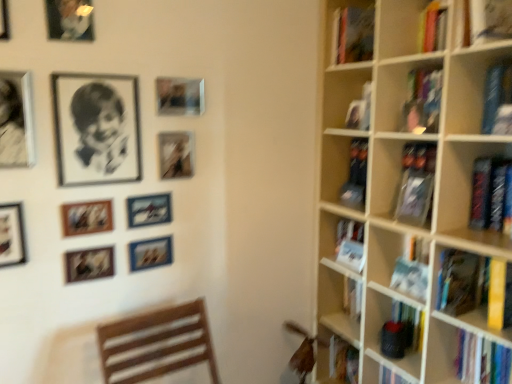
Question: Is black and white portrait at upper left oriented towards metallic silver picture frame at upper left, which is the 2th picture frame from top to bottom?

Choices:
 (A) yes
 (B) no

Answer: (B)

Question: From a real-world perspective, is black and white portrait at upper left on metallic silver picture frame at upper left, which is the 2th picture frame from top to bottom?

Choices:
 (A) no
 (B) yes

Answer: (A)

Question: Is black and white portrait at upper left beside metallic silver picture frame at upper left, which ranks as the ninth picture frame in bottom-to-top order?

Choices:
 (A) no
 (B) yes

Answer: (A)

Question: Is black and white portrait at upper left turned away from metallic silver picture frame at upper left, which is the 2th picture frame from top to bottom?

Choices:
 (A) no
 (B) yes

Answer: (A)

Question: Is black and white portrait at upper left shorter than metallic silver picture frame at upper left, which is the 2th picture frame from top to bottom?

Choices:
 (A) no
 (B) yes

Answer: (A)

Question: Considering the positions of matte black picture frame at upper center, arranged as the third picture frame when viewed from the top, and matte black picture frame at left, acting as the eighth picture frame starting from the top, in the image, is matte black picture frame at upper center, arranged as the third picture frame when viewed from the top, taller or shorter than matte black picture frame at left, acting as the eighth picture frame starting from the top,?

Choices:
 (A) tall
 (B) short

Answer: (B)

Question: In the image, is matte black picture frame at upper center, positioned as the eighth picture frame in bottom-to-top order, positioned in front of or behind matte black picture frame at left, acting as the eighth picture frame starting from the top?

Choices:
 (A) front
 (B) behind

Answer: (B)

Question: From a real-world perspective, is matte black picture frame at upper center, arranged as the third picture frame when viewed from the top, physically located above or below matte black picture frame at left, positioned as the third picture frame in bottom-to-top order?

Choices:
 (A) below
 (B) above

Answer: (B)

Question: Looking at their shapes, would you say matte black picture frame at upper center, arranged as the third picture frame when viewed from the top, is wider or thinner than matte black picture frame at left, acting as the eighth picture frame starting from the top?

Choices:
 (A) thin
 (B) wide

Answer: (A)

Question: Looking at their shapes, would you say matte wooden picture frame at upper left, the 7th picture frame positioned from the top, is wider or thinner than matte black picture frame at upper center, arranged as the third picture frame when viewed from the top?

Choices:
 (A) thin
 (B) wide

Answer: (A)

Question: Would you say matte wooden picture frame at upper left, the 7th picture frame positioned from the top, is to the left or to the right of matte black picture frame at upper center, positioned as the eighth picture frame in bottom-to-top order, in the picture?

Choices:
 (A) right
 (B) left

Answer: (B)

Question: Looking at the image, does matte wooden picture frame at upper left, positioned as the 4th picture frame in bottom-to-top order, seem bigger or smaller compared to matte black picture frame at upper center, positioned as the eighth picture frame in bottom-to-top order?

Choices:
 (A) small
 (B) big

Answer: (A)

Question: From the image's perspective, is matte wooden picture frame at upper left, the 7th picture frame positioned from the top, positioned above or below matte black picture frame at upper center, positioned as the eighth picture frame in bottom-to-top order?

Choices:
 (A) below
 (B) above

Answer: (A)

Question: Choose the correct answer: Is hardcover book at right, the first book in the bottom-to-top sequence, inside metallic silver photo frame at center-left, arranged as the ninth picture frame when viewed from the top, or outside it?

Choices:
 (A) outside
 (B) inside

Answer: (A)

Question: Based on their sizes in the image, would you say hardcover book at right, marked as the 4th book in a top-to-bottom arrangement, is bigger or smaller than metallic silver photo frame at center-left, arranged as the second picture frame when ordered from the bottom?

Choices:
 (A) big
 (B) small

Answer: (A)